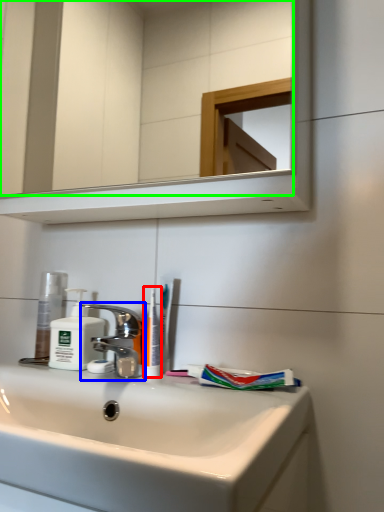
Question: Which object is the closest to the toothbrush (highlighted by a red box)? Choose among these: tap (highlighted by a blue box) or mirror (highlighted by a green box).

Choices:
 (A) tap
 (B) mirror

Answer: (A)